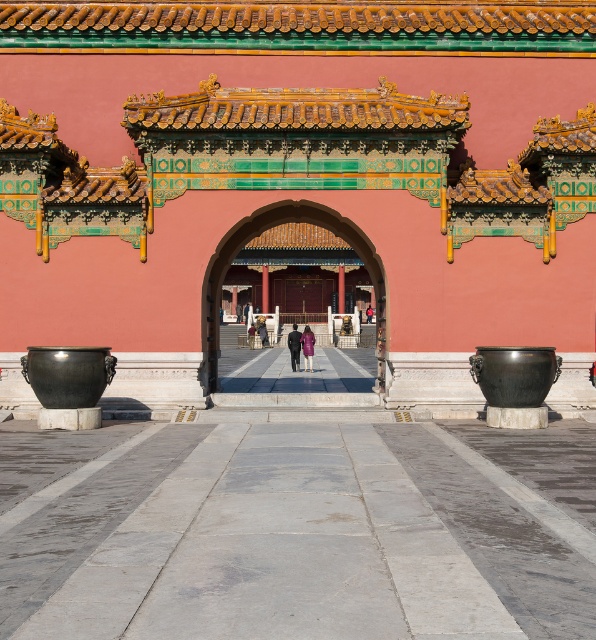
Question: Does polished bronze gate at center lie behind purple matte coat at center?

Choices:
 (A) no
 (B) yes

Answer: (A)

Question: Based on their relative distances, which object is farther from the purple matte coat at center?

Choices:
 (A) polished wood gate at center
 (B) dark blue fabric coat at center

Answer: (A)

Question: Based on their relative distances, which object is nearer to the dark blue fabric coat at center?

Choices:
 (A) dark purple coat at center
 (B) polished wood gate at center
 (C) polished bronze gate at center
 (D) purple matte coat at center

Answer: (D)

Question: Is dark blue fabric coat at center closer to the viewer compared to dark purple coat at center?

Choices:
 (A) no
 (B) yes

Answer: (B)

Question: Can you confirm if polished wood gate at center is positioned above dark blue fabric coat at center?

Choices:
 (A) yes
 (B) no

Answer: (A)

Question: Considering the real-world distances, which object is closest to the purple matte coat at center?

Choices:
 (A) polished wood gate at center
 (B) dark blue fabric coat at center

Answer: (B)